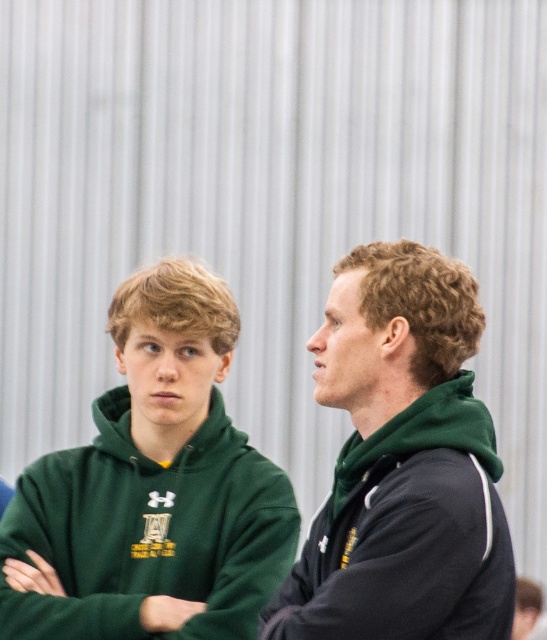
You are a photographer setting up a shot in this gymnasium. You need to place a small reflector between the two points, point (x=173, y=408) and point (x=392, y=604). Which point should the reflector be closer to in order to ensure it is placed closer to the viewer?

The reflector should be placed closer to point (x=173, y=408) because it is closer to the viewer than point (x=392, y=604).

You are a gym trainer organizing equipment and notice two hoodies on a bench. The green fleece hoodie at left and the green matte hoodie at center are stacked. Which hoodie is on top?

The green fleece hoodie at left is positioned over the green matte hoodie at center, so it is on top.

You are a photographer standing in the gymnasium. You want to take a photo of the green fleece hoodie at left and the dark jacket with white stripes on the sleeves at right. The gymnasium has a rule that all subjects in a photo must be within 30 feet of each other. Can you take this photo with both subjects?

The green fleece hoodie at left and the dark jacket with white stripes on the sleeves at right are 29.07 feet apart. Since the gymnasium requires subjects to be within 30 feet of each other, the distance is acceptable, so yes, you can take the photo with both subjects.